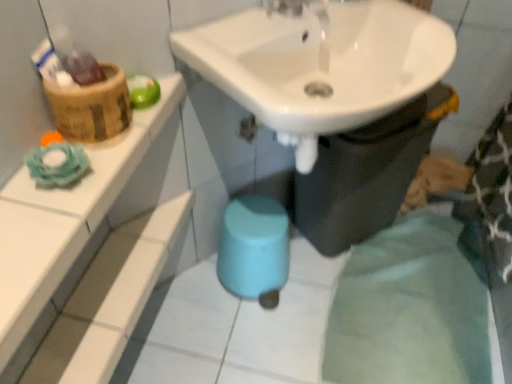
Describe the element at coordinates (321, 65) in the screenshot. I see `white glossy sink at upper center` at that location.

This screenshot has width=512, height=384. Describe the element at coordinates (91, 107) in the screenshot. I see `wooden basket at upper left` at that location.

The width and height of the screenshot is (512, 384). In order to click on white glossy sink at upper center in this screenshot , I will do `click(321, 65)`.

Which is in front, point (355, 197) or point (298, 45)?

Positioned in front is point (298, 45).

Considering the positions of objects white glossy sink at center and white glossy sink at upper center in the image provided, who is more to the left, white glossy sink at center or white glossy sink at upper center?

white glossy sink at upper center.

From the image's perspective, would you say white glossy sink at center is positioned over white glossy sink at upper center?

No.

Does white glossy sink at center touch white glossy sink at upper center?

No, white glossy sink at center is not with white glossy sink at upper center.

From their relative heights in the image, would you say white glossy sink at upper center is taller or shorter than wooden basket at upper left?

white glossy sink at upper center is taller than wooden basket at upper left.

Is white glossy sink at upper center oriented away from wooden basket at upper left?

No.

From the image's perspective, between white glossy sink at upper center and wooden basket at upper left, who is located below?

wooden basket at upper left is shown below in the image.

From the image's perspective, would you say white glossy tile at upper left is shown under white glossy sink at upper center?

Correct, white glossy tile at upper left appears lower than white glossy sink at upper center in the image.

Can you confirm if white glossy tile at upper left is shorter than white glossy sink at upper center?

Correct, white glossy tile at upper left is not as tall as white glossy sink at upper center.

Considering their positions, is white glossy tile at upper left located in front of or behind white glossy sink at upper center?

white glossy tile at upper left is positioned closer to the viewer than white glossy sink at upper center.

Based on the photo, which object is thinner, wooden basket at upper left or white glossy sink at upper center?

wooden basket at upper left.

In the image, is wooden basket at upper left positioned in front of or behind white glossy sink at upper center?

wooden basket at upper left is behind white glossy sink at upper center.

Does wooden basket at upper left touch white glossy sink at upper center?

wooden basket at upper left is not next to white glossy sink at upper center, and they're not touching.

Is wooden basket at upper left smaller than white glossy sink at upper center?

Yes, wooden basket at upper left is smaller than white glossy sink at upper center.

Is white glossy sink at center facing away from white glossy tile at upper left?

That's not correct — white glossy sink at center is not looking away from white glossy tile at upper left.

Can you confirm if white glossy sink at center is positioned to the right of white glossy tile at upper left?

Yes, white glossy sink at center is to the right of white glossy tile at upper left.

Consider the image. Is white glossy sink at center closer to the viewer compared to white glossy tile at upper left?

No, white glossy sink at center is behind white glossy tile at upper left.

Can you tell me how much white glossy sink at center and white glossy tile at upper left differ in facing direction?

The facing directions of white glossy sink at center and white glossy tile at upper left are 44.3 degrees apart.

Based on the photo, who is shorter, wooden basket at upper left or white glossy tile at upper left?

white glossy tile at upper left is shorter.

Which object is more forward, wooden basket at upper left or white glossy tile at upper left?

white glossy tile at upper left is in front.

Is white glossy tile at upper left at the back of wooden basket at upper left?

No, white glossy tile at upper left is not at the back of wooden basket at upper left.

Looking at this image, visually, is wooden basket at upper left positioned to the left or to the right of white glossy tile at upper left?

In the image, wooden basket at upper left appears on the right side of white glossy tile at upper left.

Between white glossy sink at center and wooden basket at upper left, which one appears on the left side from the viewer's perspective?

Positioned to the left is wooden basket at upper left.

Is white glossy sink at center positioned with its back to wooden basket at upper left?

white glossy sink at center is not turned away from wooden basket at upper left.

Considering the relative sizes of white glossy sink at center and wooden basket at upper left in the image provided, is white glossy sink at center bigger than wooden basket at upper left?

Yes, white glossy sink at center is bigger than wooden basket at upper left.

Considering the sizes of objects white glossy sink at center and wooden basket at upper left in the image provided, who is wider, white glossy sink at center or wooden basket at upper left?

With larger width is white glossy sink at center.

The width and height of the screenshot is (512, 384). What are the coordinates of `bidet behind the white glossy sink at upper center` in the screenshot? It's located at tap(367, 173).

The height and width of the screenshot is (384, 512). Find the location of `basket that is on the left side of white glossy sink at upper center`. basket that is on the left side of white glossy sink at upper center is located at coordinates (x=91, y=107).

When comparing their distances from white glossy tile at upper left, does white glossy sink at center or wooden basket at upper left seem closer?

wooden basket at upper left.

Estimate the real-world distances between objects in this image. Which object is closer to white glossy sink at center, white glossy sink at upper center or white glossy tile at upper left?

white glossy sink at upper center lies closer to white glossy sink at center than the other object.

From the image, which object appears to be farther from white glossy tile at upper left, white glossy sink at center or white glossy sink at upper center?

Based on the image, white glossy sink at center appears to be further to white glossy tile at upper left.

From the image, which object appears to be nearer to white glossy sink at upper center, white glossy tile at upper left or wooden basket at upper left?

wooden basket at upper left.

Estimate the real-world distances between objects in this image. Which object is closer to white glossy sink at center, wooden basket at upper left or white glossy sink at upper center?

white glossy sink at upper center is positioned closer to the anchor white glossy sink at center.

When comparing their distances from wooden basket at upper left, does white glossy sink at upper center or white glossy tile at upper left seem further?

white glossy sink at upper center is further to wooden basket at upper left.

Based on their spatial positions, is white glossy sink at center or white glossy tile at upper left further from white glossy sink at upper center?

white glossy tile at upper left is positioned further to the anchor white glossy sink at upper center.

Estimate the real-world distances between objects in this image. Which object is closer to white glossy sink at upper center, wooden basket at upper left or white glossy sink at center?

white glossy sink at center lies closer to white glossy sink at upper center than the other object.

The height and width of the screenshot is (384, 512). I want to click on basket situated between white glossy tile at upper left and white glossy sink at center from left to right, so tap(91, 107).

I want to click on sink between wooden basket at upper left and white glossy sink at center from left to right, so click(321, 65).

Identify the location of basket between white glossy tile at upper left and white glossy sink at upper center from left to right. (91, 107).

Locate an element on the screen. This screenshot has width=512, height=384. sink situated between white glossy tile at upper left and white glossy sink at center from left to right is located at coordinates (321, 65).